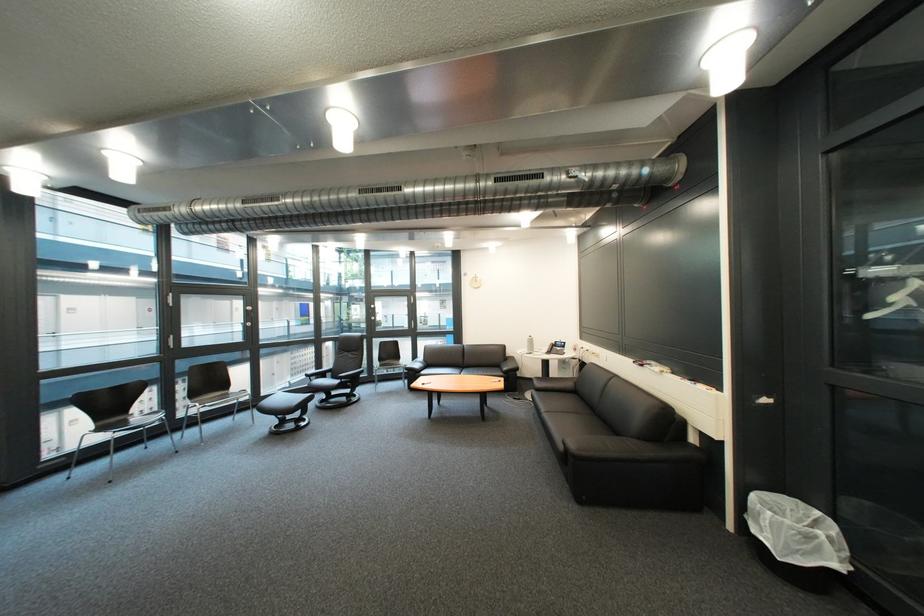
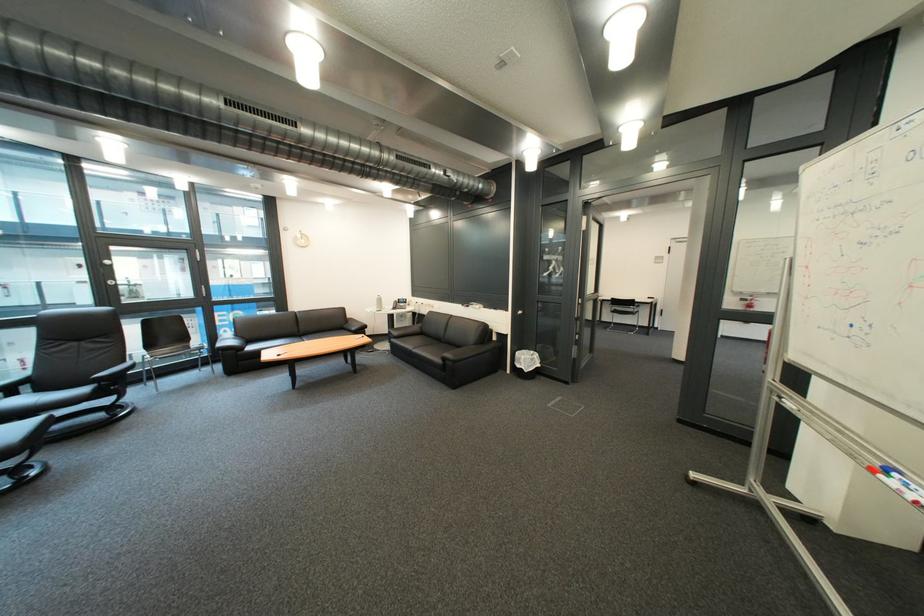
Where in the second image is the point corresponding to point (734, 390) from the first image?

(520, 312)